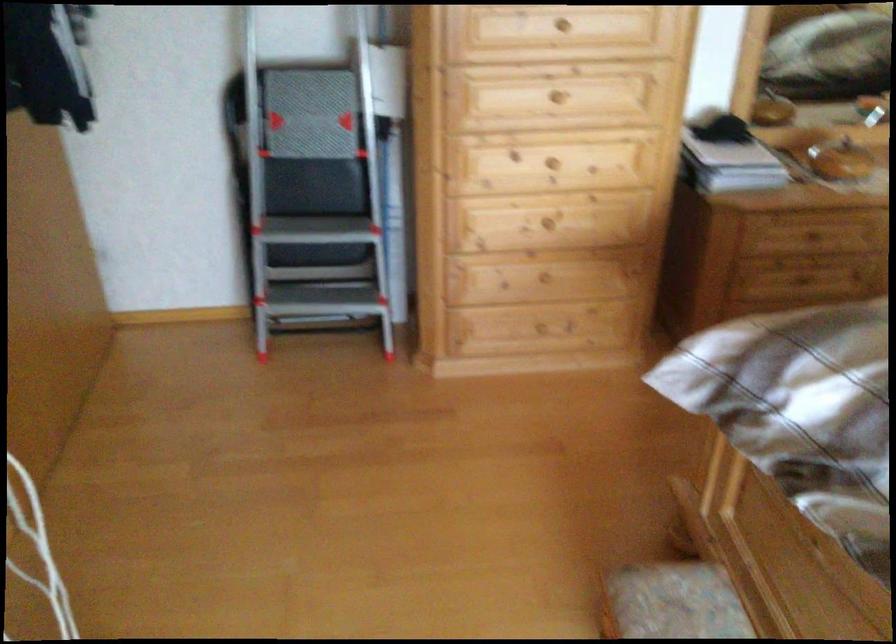
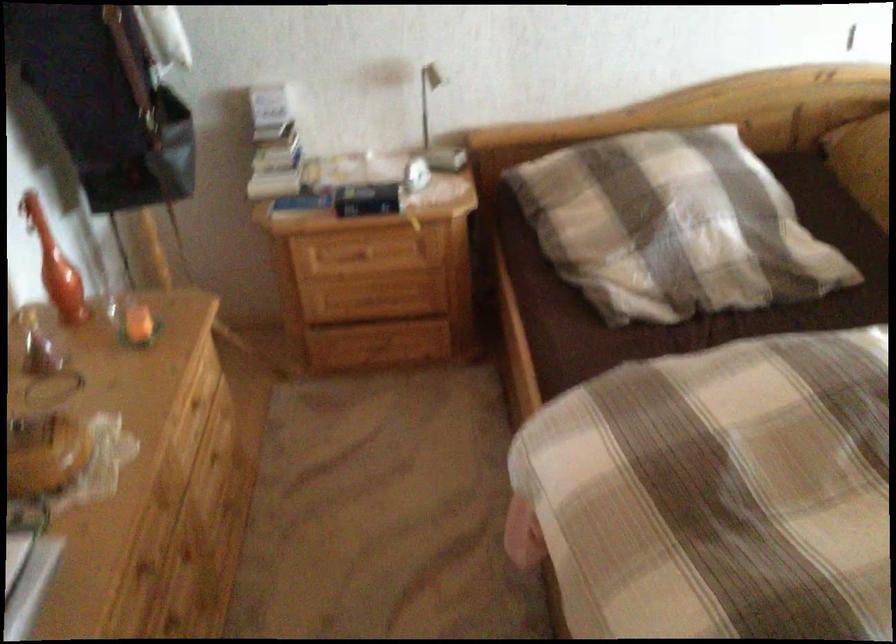
Find the pixel in the second image that matches (x=799, y=272) in the first image.

(174, 627)